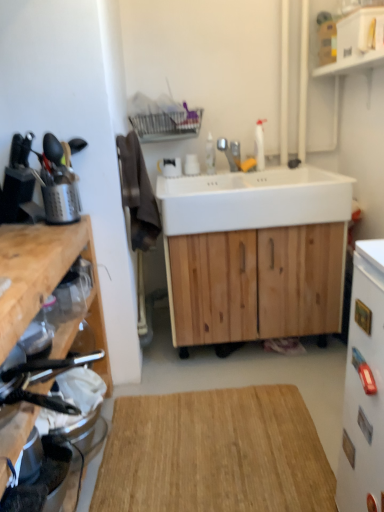
Identify the location of vacant area that lies between natural wood cabinet at center, the 1th cabinetry viewed from the right, and natural wood cutting board at center. Image resolution: width=384 pixels, height=512 pixels. (175, 375).